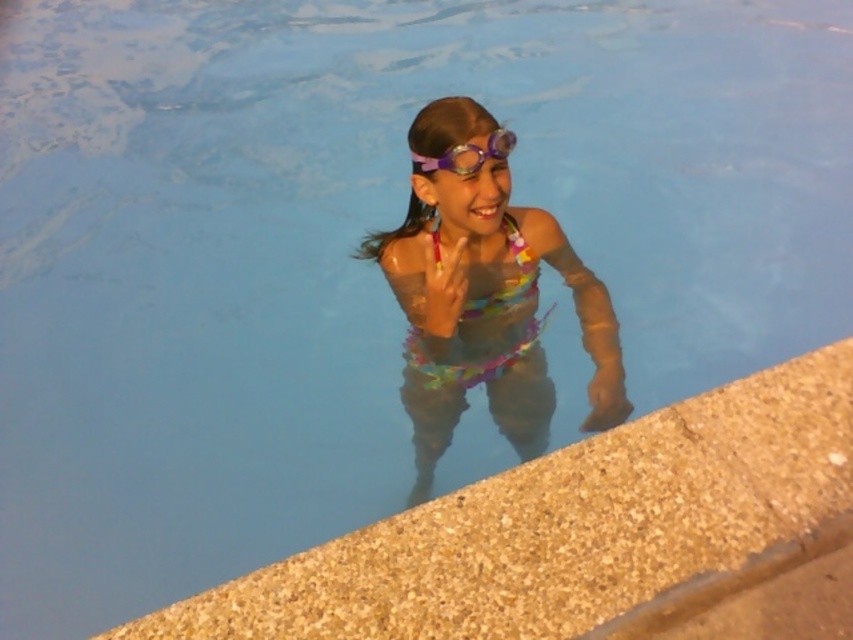
Is smooth concrete ledge at lower right positioned before multicolored fabric swimsuit at center?

Yes, it is in front of multicolored fabric swimsuit at center.

The width and height of the screenshot is (853, 640). I want to click on smooth concrete ledge at lower right, so click(x=595, y=536).

This screenshot has width=853, height=640. I want to click on smooth concrete ledge at lower right, so click(595, 536).

Between point (805, 560) and point (495, 157), which one is positioned in front?

Point (805, 560)

Between smooth concrete ledge at lower right and purple matte goggles at upper center, which one has more height?

Standing taller between the two is smooth concrete ledge at lower right.

Does point (672, 451) come farther from viewer compared to point (494, 136)?

No, (672, 451) is in front of (494, 136).

At what (x,y) coordinates should I click in order to perform the action: click on smooth concrete ledge at lower right. Please return your answer as a coordinate pair (x, y). The height and width of the screenshot is (640, 853). Looking at the image, I should click on (595, 536).

How far apart are multicolored fabric swimsuit at center and purple matte goggles at upper center?

multicolored fabric swimsuit at center is 16.87 inches from purple matte goggles at upper center.

Who is taller, multicolored fabric swimsuit at center or purple matte goggles at upper center?

multicolored fabric swimsuit at center

Between point (473, 372) and point (410, 156), which one is positioned in front?

Point (410, 156)

This screenshot has width=853, height=640. What are the coordinates of `multicolored fabric swimsuit at center` in the screenshot? It's located at (486, 314).